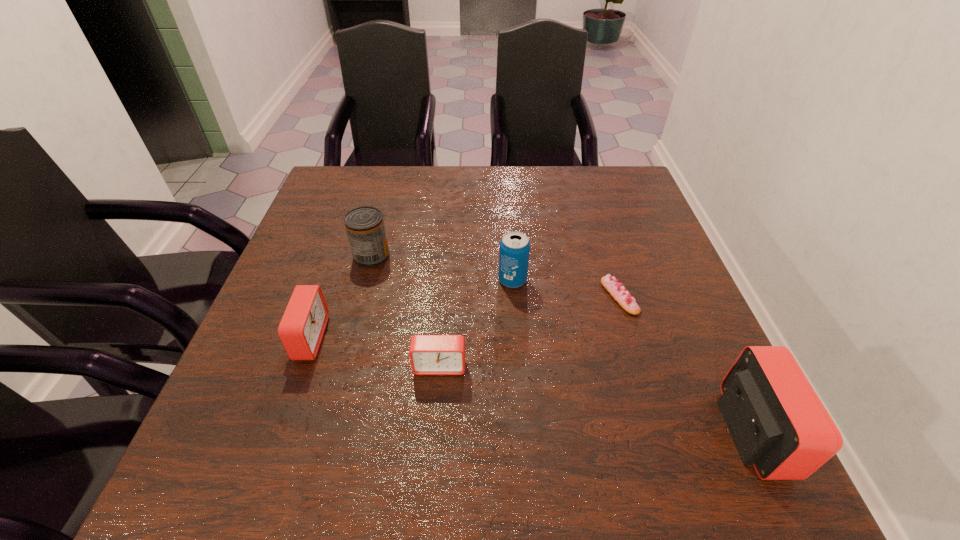
Locate an element on the screen. Image resolution: width=960 pixels, height=540 pixels. the fifth object from left to right is located at coordinates (617, 291).

Where is `free location located 0.220m on the front-facing side of the leftmost object`? This screenshot has height=540, width=960. free location located 0.220m on the front-facing side of the leftmost object is located at coordinates (431, 338).

This screenshot has height=540, width=960. Find the location of `vacant space located on the front-facing side of the shortest alarm clock`. vacant space located on the front-facing side of the shortest alarm clock is located at coordinates (437, 410).

You are a GUI agent. You are given a task and a screenshot of the screen. Output one action in this format:
    pyautogui.click(x=<x>, y=<y>)
    Task: Click on the free point located on the back of the can
    This screenshot has width=960, height=540.
    Given the screenshot: What is the action you would take?
    pyautogui.click(x=388, y=195)

The height and width of the screenshot is (540, 960). I want to click on blank space located on the front of the soda can, so click(x=517, y=339).

Where is `vacant region located on the back of the second object from right to left`? vacant region located on the back of the second object from right to left is located at coordinates (600, 235).

Locate an element on the screen. object that is at the near edge is located at coordinates (778, 424).

Locate an element on the screen. The image size is (960, 540). alarm clock located in the left edge section of the desktop is located at coordinates (302, 327).

The height and width of the screenshot is (540, 960). Identify the location of can present at the left edge. pos(365,227).

This screenshot has height=540, width=960. I want to click on alarm clock present at the right edge, so click(778, 424).